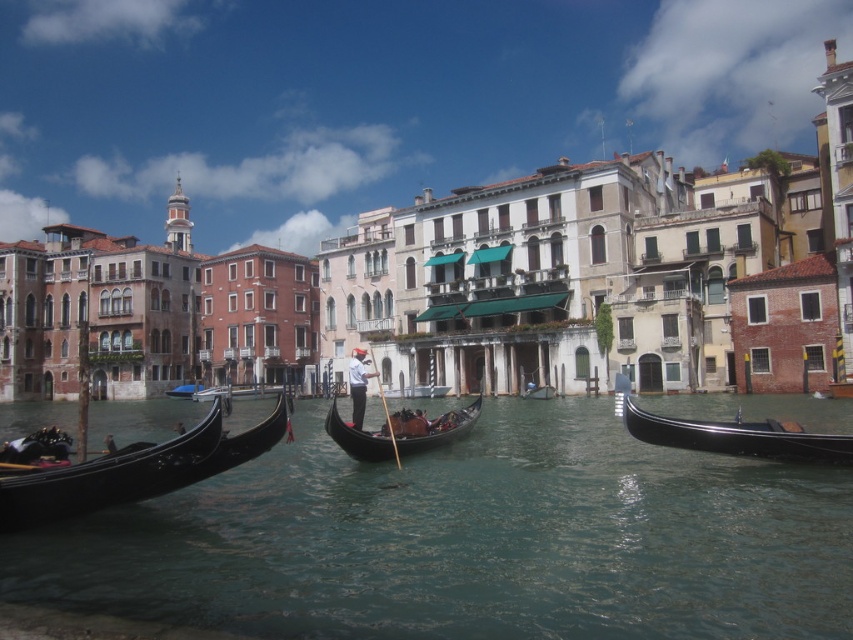
The image size is (853, 640). Find the location of `shiny black gondola at right`. shiny black gondola at right is located at coordinates (734, 435).

Describe the element at coordinates (734, 435) in the screenshot. Image resolution: width=853 pixels, height=640 pixels. I see `shiny black gondola at right` at that location.

Between point (840, 448) and point (357, 396), which one is positioned behind?

Point (357, 396)

Locate an element on the screen. shiny black gondola at right is located at coordinates (734, 435).

Can you confirm if clear water at center is positioned to the right of shiny black gondola at right?

Incorrect, clear water at center is not on the right side of shiny black gondola at right.

Is clear water at center positioned in front of shiny black gondola at right?

Yes, it is.

Who is more forward, (549, 518) or (630, 432)?

Point (549, 518) is more forward.

Find the location of `clear water at center`. clear water at center is located at coordinates (469, 540).

Between point (782, 442) and point (553, 392), which one is positioned in front?

Point (782, 442) is more forward.

Can you confirm if shiny black gondola at right is bigger than wooden gondola at center?

Indeed, shiny black gondola at right has a larger size compared to wooden gondola at center.

Does point (766, 429) come in front of point (541, 387)?

Yes, point (766, 429) is in front of point (541, 387).

Image resolution: width=853 pixels, height=640 pixels. I want to click on shiny black gondola at right, so click(x=734, y=435).